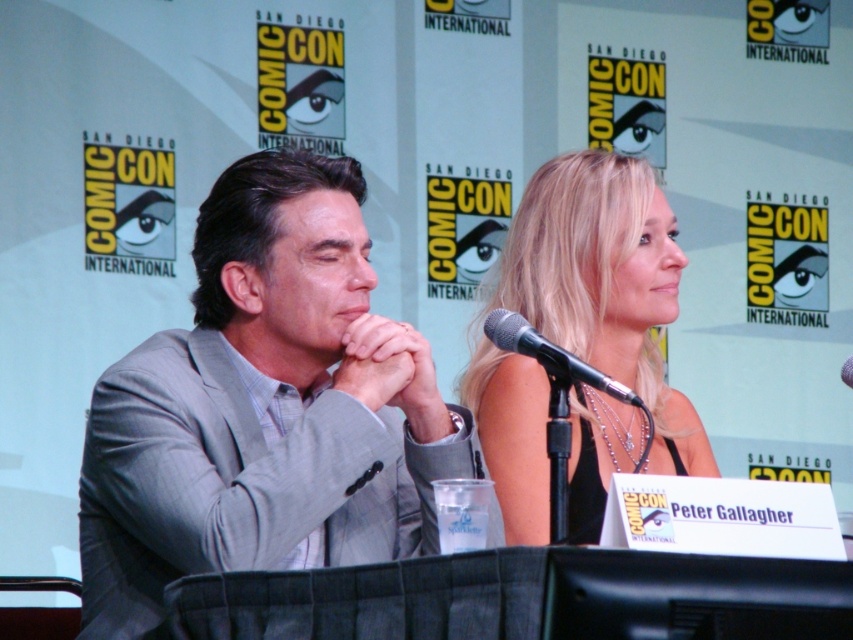
At what (x,y) coordinates should I click in order to perform the action: click on gray suit at center. Please return your answer as a coordinate pair (x, y). Looking at the image, I should click on (264, 408).

Is gray suit at center to the right of black metallic microphone at center from the viewer's perspective?

No, gray suit at center is not to the right of black metallic microphone at center.

You are a GUI agent. You are given a task and a screenshot of the screen. Output one action in this format:
    pyautogui.click(x=<x>, y=<y>)
    Task: Click on the gray suit at center
    The height and width of the screenshot is (640, 853).
    Given the screenshot: What is the action you would take?
    pyautogui.click(x=264, y=408)

Find the location of a particular element. This screenshot has width=853, height=640. gray suit at center is located at coordinates (264, 408).

Does gray suit at center have a greater height compared to blonde hair at center?

In fact, gray suit at center may be shorter than blonde hair at center.

Measure the distance between point [427,520] and camera.

The distance of point [427,520] from camera is 4.15 meters.

I want to click on gray suit at center, so click(x=264, y=408).

Can you confirm if blonde hair at center is smaller than black metallic microphone at center?

Incorrect, blonde hair at center is not smaller in size than black metallic microphone at center.

Which is in front, point (477, 371) or point (567, 376)?

Point (567, 376)

Who is more forward, (x=573, y=396) or (x=583, y=381)?

Positioned in front is point (x=583, y=381).

I want to click on blonde hair at center, so click(604, 316).